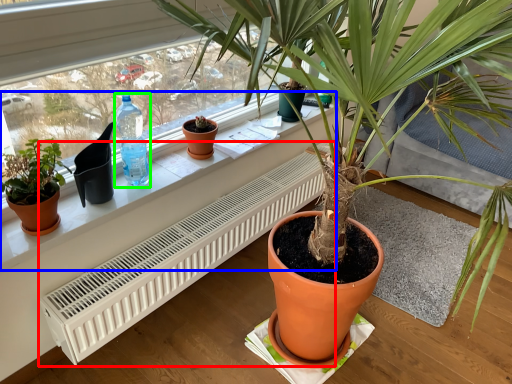
Question: Considering the real-world distances, which object is closest to air conditioner (highlighted by a red box)? window sill (highlighted by a blue box) or bottle (highlighted by a green box).

Choices:
 (A) window sill
 (B) bottle

Answer: (A)